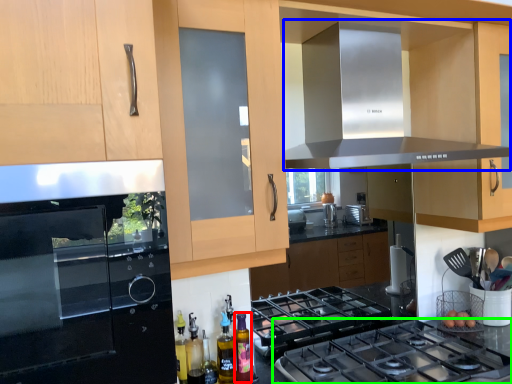
Question: Which object is the closest to the bottle (highlighted by a red box)? Choose among these: exhaust hood (highlighted by a blue box) or gas stove (highlighted by a green box).

Choices:
 (A) exhaust hood
 (B) gas stove

Answer: (B)